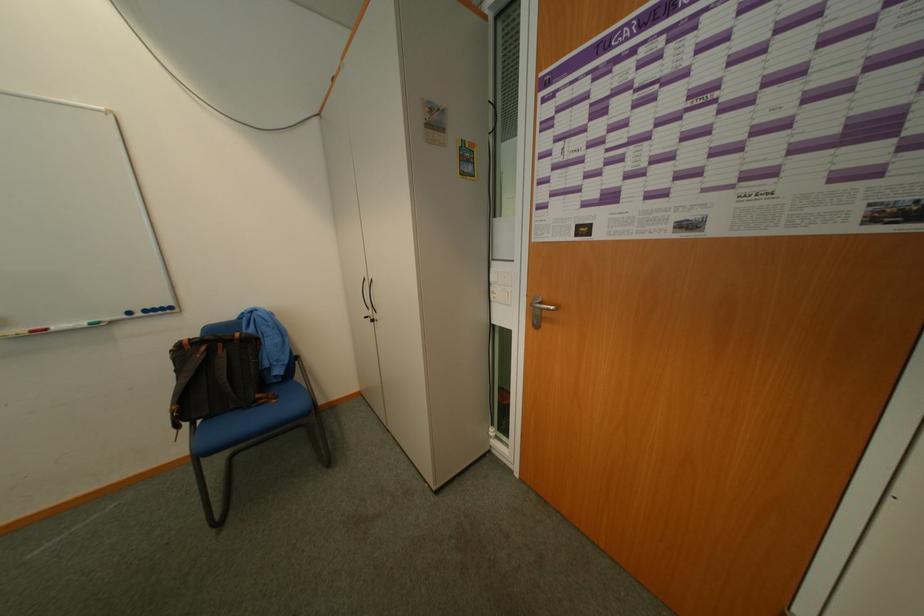
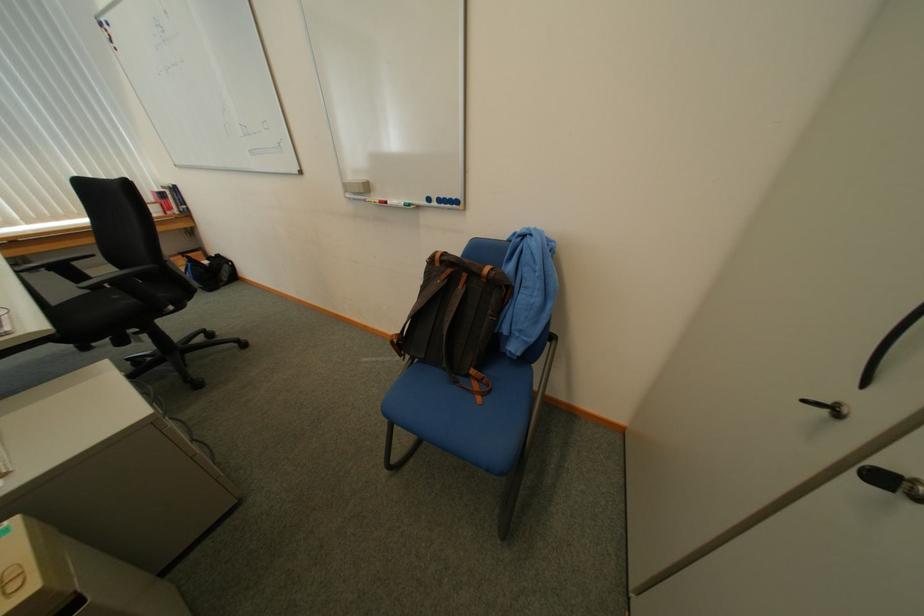
The point at (55, 331) is marked in the first image. Where is the corresponding point in the second image?

(396, 204)